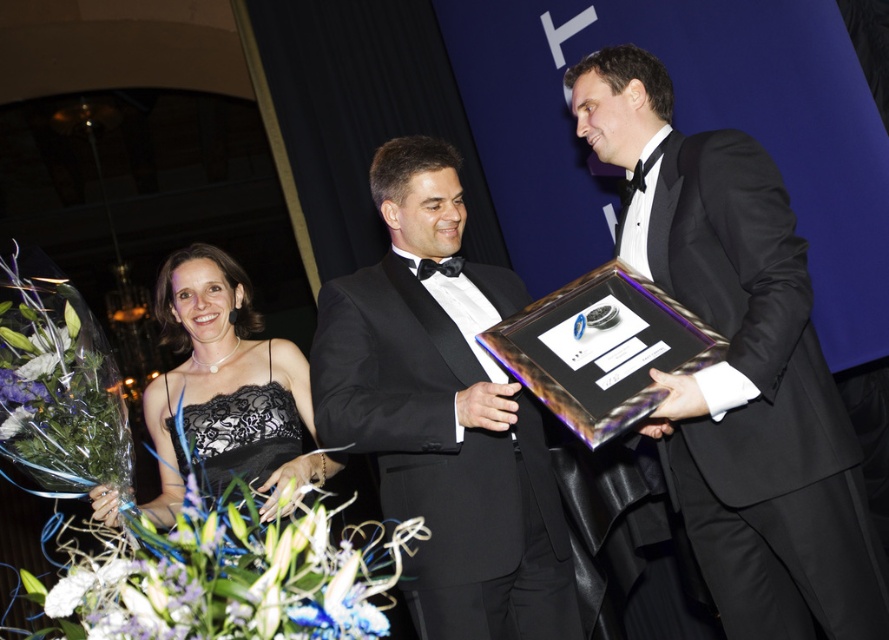
You are a photographer at the event and need to position two guests for a group photo. The guests are wearing the black lace dress at lower left and the black lace cocktail dress at center. Which guest should you move closer to the camera to ensure both appear equally sized in the photo?

Move the guest in the black lace cocktail dress at center closer to the camera because the black lace dress at lower left is bigger, so moving the smaller dress closer will balance their sizes in the photo.

You are a photographer at the event and need to capture a photo where both the black satin tuxedo at center and the black lace dress at lower left are visible. Based on their positions, which one appears higher in the photo?

The black satin tuxedo at center appears higher in the photo because it is positioned above the black lace dress at lower left.